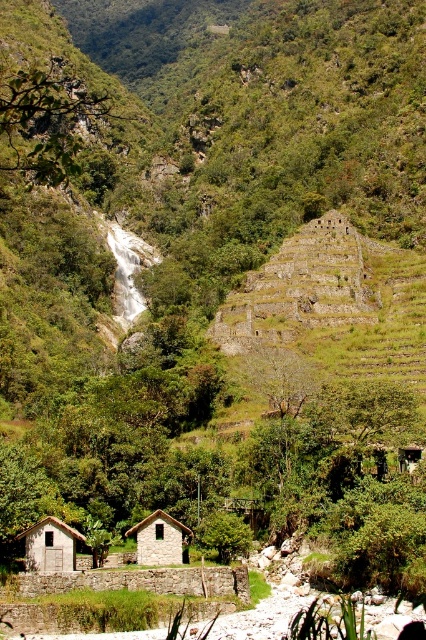
Question: Which point is closer to the camera taking this photo?

Choices:
 (A) (45, 538)
 (B) (144, 556)

Answer: (A)

Question: Can you confirm if gray stone hut at lower left is positioned to the left of stone textured hut at center?

Choices:
 (A) yes
 (B) no

Answer: (A)

Question: Does gray stone hut at lower left appear under stone textured hut at center?

Choices:
 (A) yes
 (B) no

Answer: (B)

Question: Is gray stone hut at lower left above stone textured hut at center?

Choices:
 (A) yes
 (B) no

Answer: (A)

Question: Which object appears farthest from the camera in this image?

Choices:
 (A) gray stone hut at lower left
 (B) stone textured hut at center

Answer: (B)